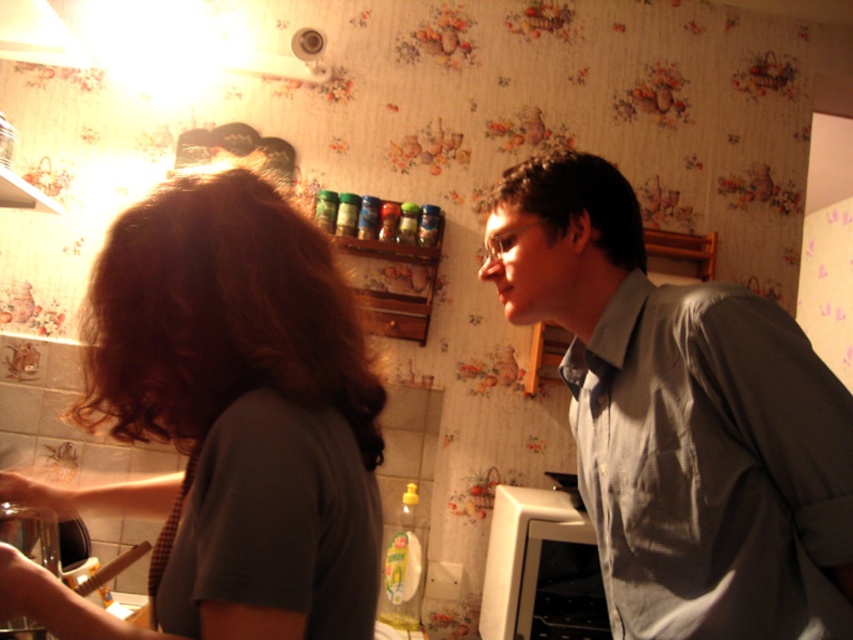
Who is positioned more to the left, gray cotton shirt at right or white matte oven at lower right?

Positioned to the left is white matte oven at lower right.

Is gray cotton shirt at right shorter than white matte oven at lower right?

In fact, gray cotton shirt at right may be taller than white matte oven at lower right.

In order to click on gray cotton shirt at right in this screenshot , I will do `click(682, 419)`.

Image resolution: width=853 pixels, height=640 pixels. I want to click on gray cotton shirt at right, so click(x=682, y=419).

Which of these two, dark brown hair at left or white matte oven at lower right, stands taller?

dark brown hair at left is taller.

Is dark brown hair at left to the right of white matte oven at lower right from the viewer's perspective?

Incorrect, dark brown hair at left is not on the right side of white matte oven at lower right.

You are a GUI agent. You are given a task and a screenshot of the screen. Output one action in this format:
    pyautogui.click(x=<x>, y=<y>)
    Task: Click on the dark brown hair at left
    
    Given the screenshot: What is the action you would take?
    pyautogui.click(x=225, y=420)

This screenshot has height=640, width=853. Describe the element at coordinates (682, 419) in the screenshot. I see `gray cotton shirt at right` at that location.

Can you confirm if gray cotton shirt at right is shorter than white plastic exhaust hood at upper left?

In fact, gray cotton shirt at right may be taller than white plastic exhaust hood at upper left.

From the picture: Who is more forward, (x=689, y=433) or (x=45, y=60)?

Point (x=689, y=433) is in front.

Where is `gray cotton shirt at right`? The width and height of the screenshot is (853, 640). gray cotton shirt at right is located at coordinates (682, 419).